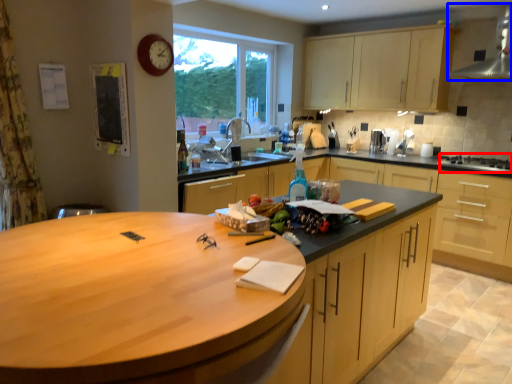
Question: Which object is closer to the camera taking this photo, gas stove (highlighted by a red box) or exhaust hood (highlighted by a blue box)?

Choices:
 (A) gas stove
 (B) exhaust hood

Answer: (B)